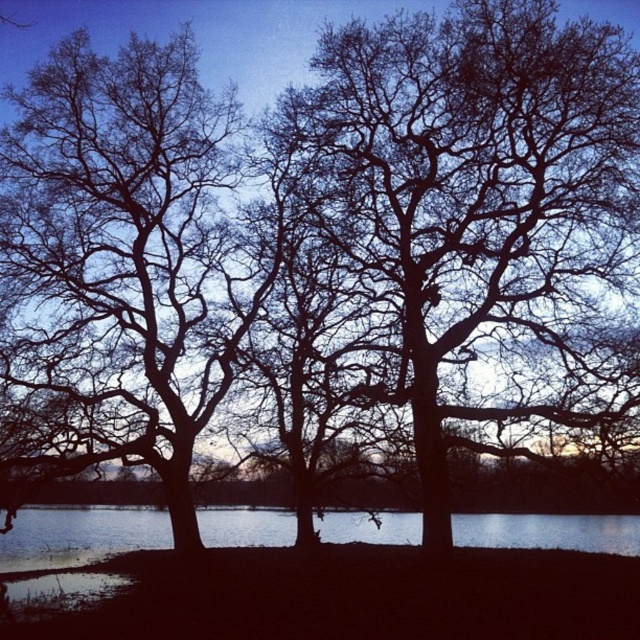
Question: Is bare branches at left below clear water at center?

Choices:
 (A) no
 (B) yes

Answer: (A)

Question: Does bare branches at left have a larger size compared to clear water at center?

Choices:
 (A) no
 (B) yes

Answer: (B)

Question: Is bare branches at left positioned before clear water at center?

Choices:
 (A) no
 (B) yes

Answer: (B)

Question: Which object appears closest to the camera in this image?

Choices:
 (A) bare branches at left
 (B) clear water at center

Answer: (A)

Question: Which object is closer to the camera taking this photo?

Choices:
 (A) clear water at center
 (B) bare branches at left

Answer: (B)